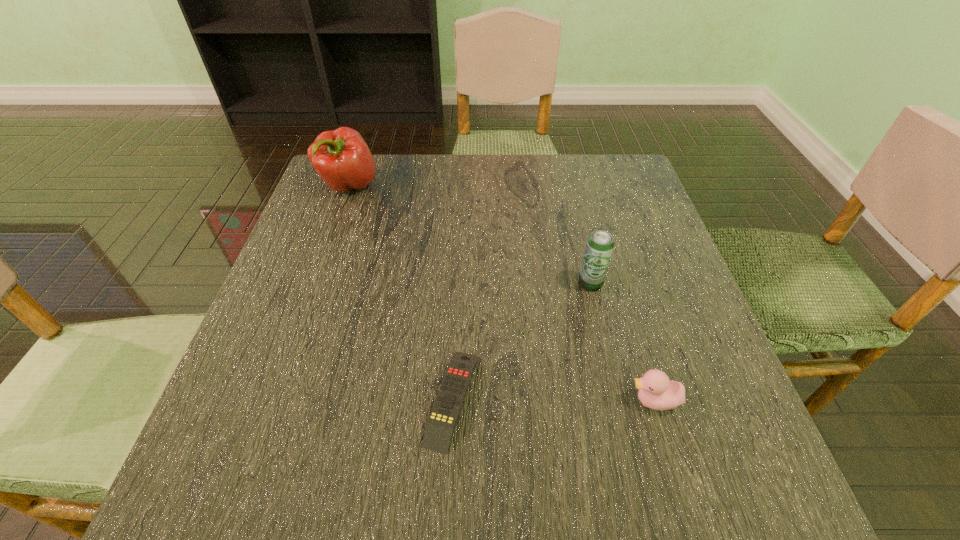
Identify the location of free area in between the tallest object and the beer can. (469, 234).

Locate an element on the screen. This screenshot has width=960, height=540. free space that is in between the pepper and the duckling is located at coordinates (501, 293).

You are a GUI agent. You are given a task and a screenshot of the screen. Output one action in this format:
    pyautogui.click(x=<x>, y=<y>)
    Task: Click on the empty location between the third object from right to left and the third tallest object
    
    Given the screenshot: What is the action you would take?
    pyautogui.click(x=553, y=400)

At what (x,y) coordinates should I click in order to perform the action: click on empty space between the second shortest object and the remote control. Please return your answer as a coordinate pair (x, y). This screenshot has height=540, width=960. Looking at the image, I should click on (553, 400).

Image resolution: width=960 pixels, height=540 pixels. I want to click on object identified as the second closest to the tallest object, so click(x=600, y=244).

Find the location of a particular element. object that stands as the closest to the third tallest object is located at coordinates (600, 244).